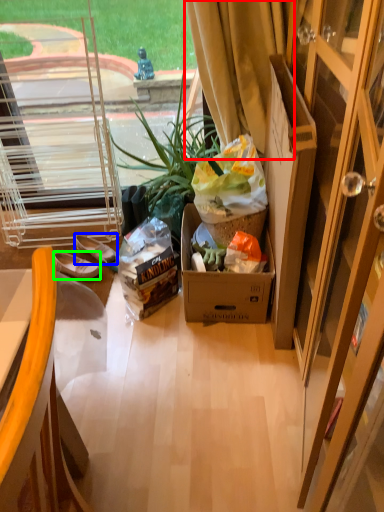
Question: Which is farther away from curtain (highlighted by a red box)? footwear (highlighted by a blue box) or slippers (highlighted by a green box)?

Choices:
 (A) footwear
 (B) slippers

Answer: (B)